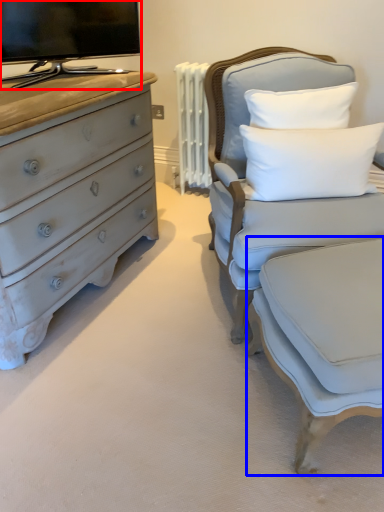
Question: Among these objects, which one is nearest to the camera, television (highlighted by a red box) or swivel chair (highlighted by a blue box)?

Choices:
 (A) television
 (B) swivel chair

Answer: (B)